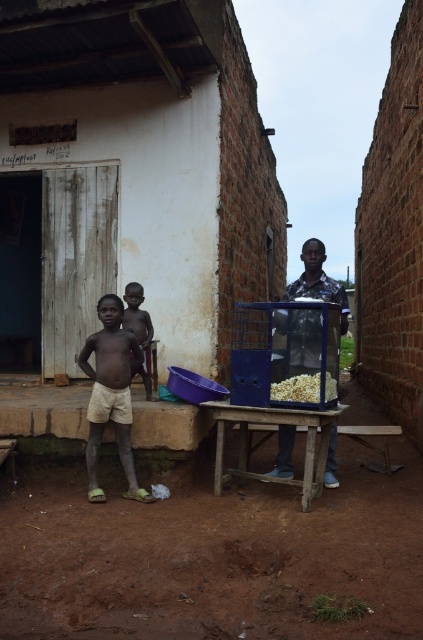
Between light beige shorts at center and white popcorn at center, which one is positioned lower?

Positioned lower is light beige shorts at center.

Does light beige shorts at center have a greater height compared to white popcorn at center?

Indeed, light beige shorts at center has a greater height compared to white popcorn at center.

Locate an element on the screen. Image resolution: width=423 pixels, height=640 pixels. light beige shorts at center is located at coordinates (110, 394).

Locate an element on the screen. The width and height of the screenshot is (423, 640). light beige shorts at center is located at coordinates (110, 394).

Who is more distant from viewer, (104,497) or (137,284)?

Positioned behind is point (137,284).

Where is `light beige shorts at center`? light beige shorts at center is located at coordinates (110, 394).

Who is taller, light beige shorts at center or metallic popcorn machine at center?

metallic popcorn machine at center is taller.

Looking at this image, which is more to the left, light beige shorts at center or metallic popcorn machine at center?

From the viewer's perspective, light beige shorts at center appears more on the left side.

Is point (96, 496) closer to viewer compared to point (335, 477)?

Yes, it is.

Locate an element on the screen. The image size is (423, 640). light beige shorts at center is located at coordinates (110, 394).